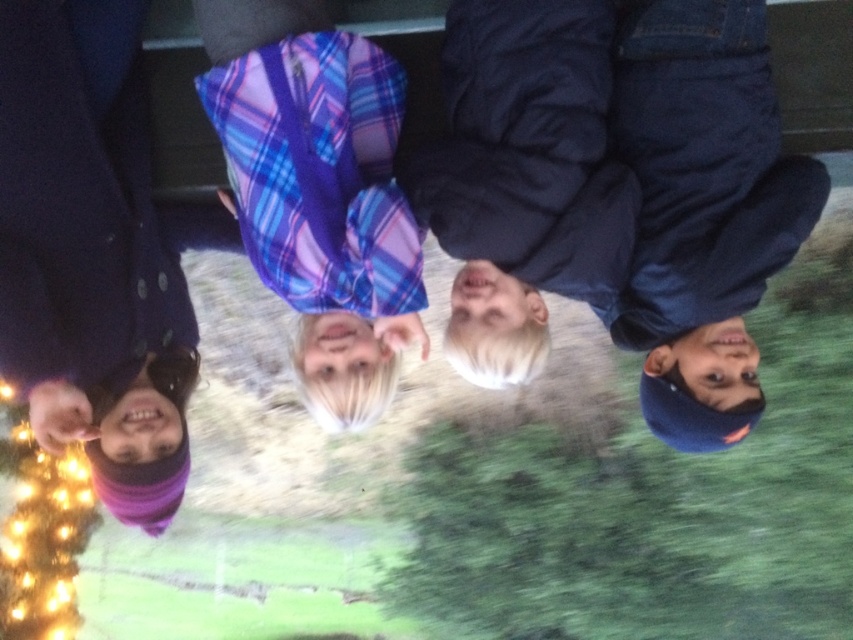
Based on the rotated image, which of the two points, point (572, 132) or point (317, 76), is closer to the viewer?

Point (317, 76) is closer to the viewer because it is in front of point 0.209, 0.673 according to the description.

You are a fashion designer analyzing the rotated image of two people in the center. Which clothing item is taller between the dark blue puffy jacket at center and the plaid fabric shirt at center?

The dark blue puffy jacket at center is much taller than the plaid fabric shirt at center.

You are a fashion designer analyzing the rotated image. You need to determine the spatial relationship between the purple woolen hat at lower left and the plaid fabric shirt at center. Which one is positioned lower in the rotated image?

The purple woolen hat at lower left is positioned lower than the plaid fabric shirt at center in the rotated image.